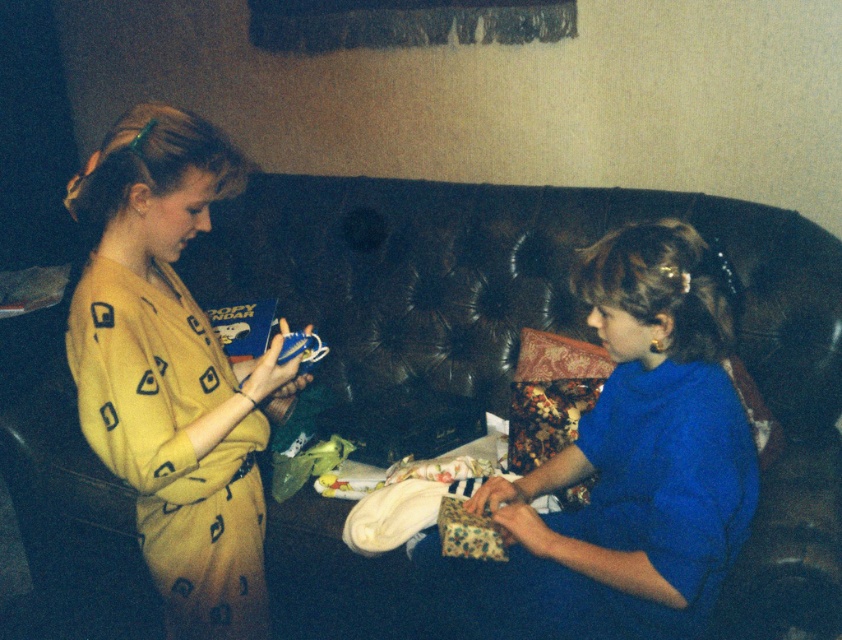
You are standing in the living room and want to place a new rug under the leather couch at center. According to the coordinates provided, where should you position the rug?

The leather couch at center is located at coordinates point (542, 330), so you should position the rug directly under that point to place it under the leather couch at center.

You are standing in the living room and want to take a photo of the point at coordinates (x=99, y=326). If your camera has a focal length of 50mm and you are currently 10 feet away from the point, should you move closer or farther away to focus properly?

The point at coordinates (x=99, y=326) is 4.27 feet from the camera. Since you are currently 10 feet away, you need to move closer to reduce the distance to approximately 4.27 feet for proper focus.